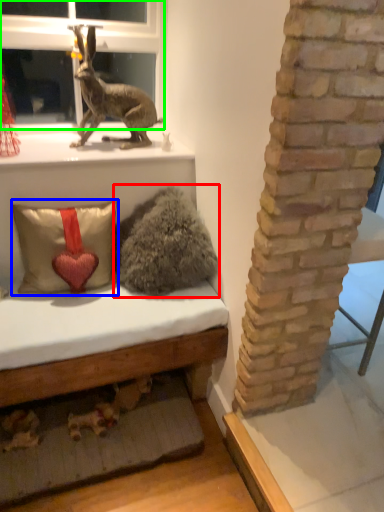
Question: Which object is positioned farthest from animal (highlighted by a red box)? Select from pillow (highlighted by a blue box) and bay window (highlighted by a green box).

Choices:
 (A) pillow
 (B) bay window

Answer: (B)